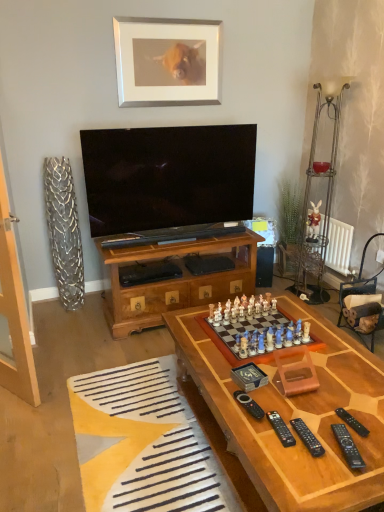
This screenshot has height=512, width=384. What are the coordinates of `vacant space situated above wooden chess set at center (from a real-world perspective)` in the screenshot? It's located at (254, 330).